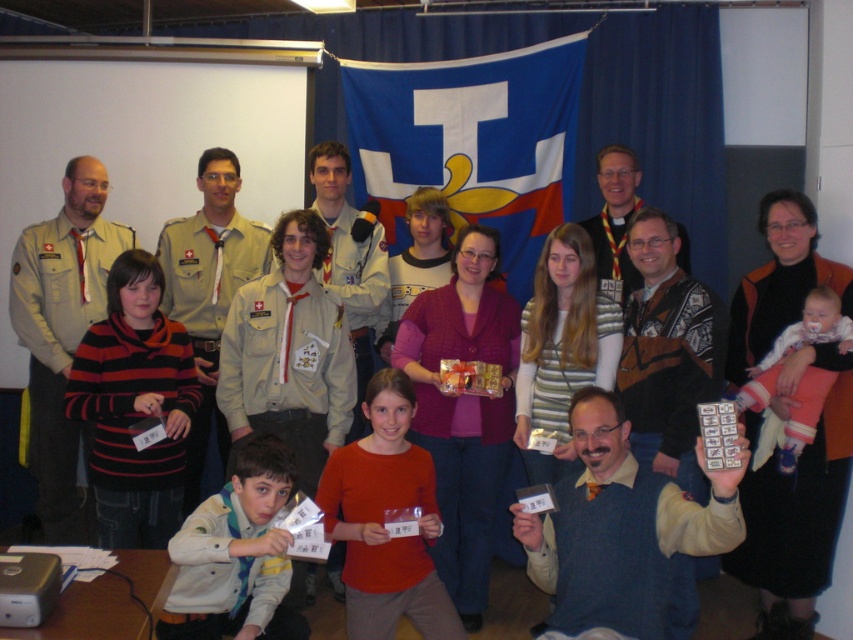
Question: Does knitted sweater at center appear under light brown uniform at center?

Choices:
 (A) no
 (B) yes

Answer: (B)

Question: Can you confirm if knitted sweater at center is thinner than khaki uniform at center?

Choices:
 (A) no
 (B) yes

Answer: (B)

Question: Which point is farther from the camera taking this photo?

Choices:
 (A) (625, 312)
 (B) (364, 168)
 (C) (602, 406)
 (D) (56, 346)

Answer: (B)

Question: Which object is farther from the camera taking this photo?

Choices:
 (A) matte black vest at center
 (B) light brown uniform at center

Answer: (B)

Question: Is blue fabric flag at upper center positioned in front of matte black vest at center?

Choices:
 (A) no
 (B) yes

Answer: (A)

Question: Which object is the closest to the khaki uniform at center?

Choices:
 (A) blue sweater at center
 (B) blue fabric flag at upper center

Answer: (B)